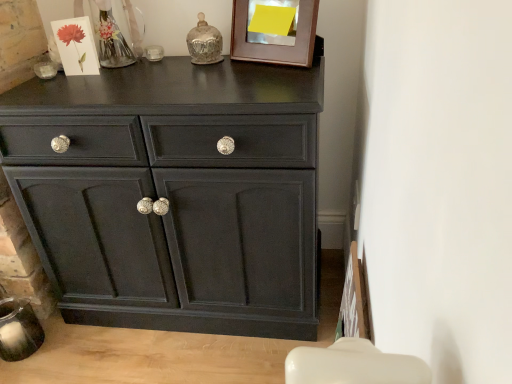
Locate an element on the screen. Image resolution: width=512 pixels, height=384 pixels. free space in front of wooden picture frame at upper center is located at coordinates (276, 75).